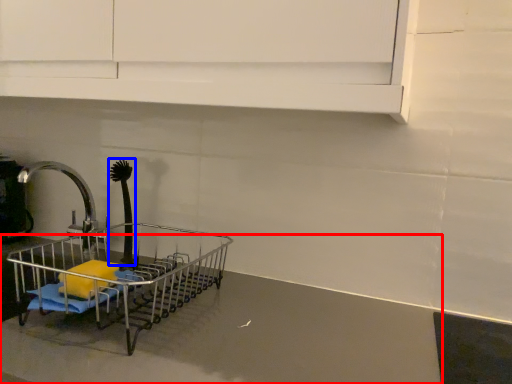
Question: Which object appears closest to the camera in this image, counter top (highlighted by a red box) or brush (highlighted by a blue box)?

Choices:
 (A) counter top
 (B) brush

Answer: (A)